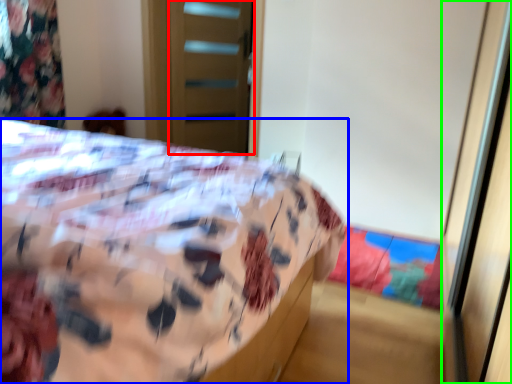
Question: Considering the real-world distances, which object is farthest from screen door (highlighted by a red box)? bed (highlighted by a blue box) or screen door (highlighted by a green box)?

Choices:
 (A) bed
 (B) screen door

Answer: (B)